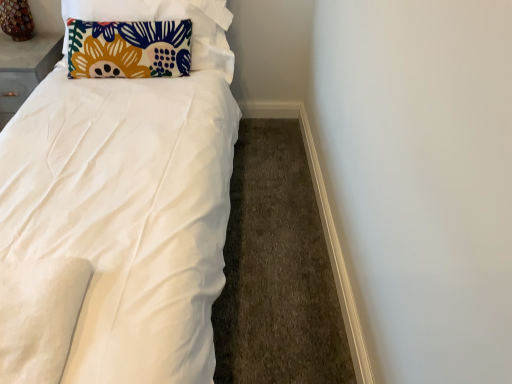
This screenshot has width=512, height=384. What are the coordinates of `free spot above white smooth baseboard at lower right (from a real-world perspective)` in the screenshot? It's located at (322, 206).